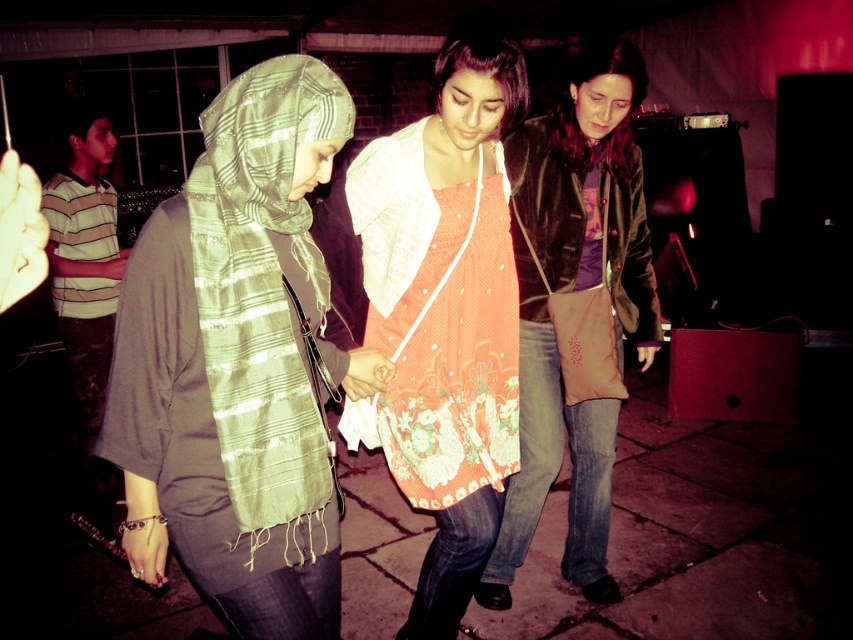
Question: Is orange printed dress at center positioned in front of striped cotton shirt at left?

Choices:
 (A) yes
 (B) no

Answer: (A)

Question: Is orange printed dress at center further to the viewer compared to green striped scarf at left?

Choices:
 (A) no
 (B) yes

Answer: (B)

Question: Which point is closer to the camera taking this photo?

Choices:
 (A) (309, 324)
 (B) (436, 600)
 (C) (593, 99)

Answer: (A)

Question: Considering the real-world distances, which object is farthest from the green striped scarf at left?

Choices:
 (A) striped cotton shirt at left
 (B) orange printed dress at center

Answer: (A)

Question: Among these points, which one is farthest from the camera?

Choices:
 (A) (308, 268)
 (B) (611, 360)

Answer: (B)

Question: Is orange printed dress at center in front of brown suede jacket at center?

Choices:
 (A) no
 (B) yes

Answer: (B)